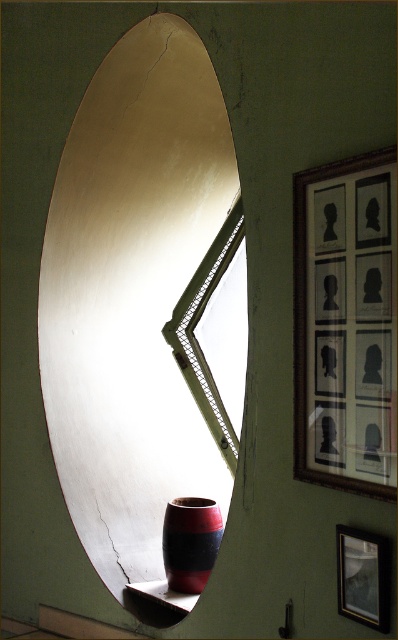
Question: Considering the relative positions of wooden framed portraits at upper right and green textured window at center in the image provided, where is wooden framed portraits at upper right located with respect to green textured window at center?

Choices:
 (A) below
 (B) above

Answer: (B)

Question: Is metallic gold mirror at center below matte black picture frame at upper right?

Choices:
 (A) no
 (B) yes

Answer: (B)

Question: Which object appears farthest from the camera in this image?

Choices:
 (A) matte black picture frame at upper right
 (B) metallic gold mirror at center

Answer: (B)

Question: From the image, what is the correct spatial relationship of metallic gold mirror at center in relation to wooden framed portraits at upper right?

Choices:
 (A) left
 (B) right

Answer: (A)

Question: Which point is farther from the camera taking this photo?

Choices:
 (A) (175, 547)
 (B) (333, 285)

Answer: (A)

Question: Which of the following is the closest to the observer?

Choices:
 (A) green textured window at center
 (B) matte red and black vase at lower center
 (C) matte black picture frame at upper right

Answer: (C)